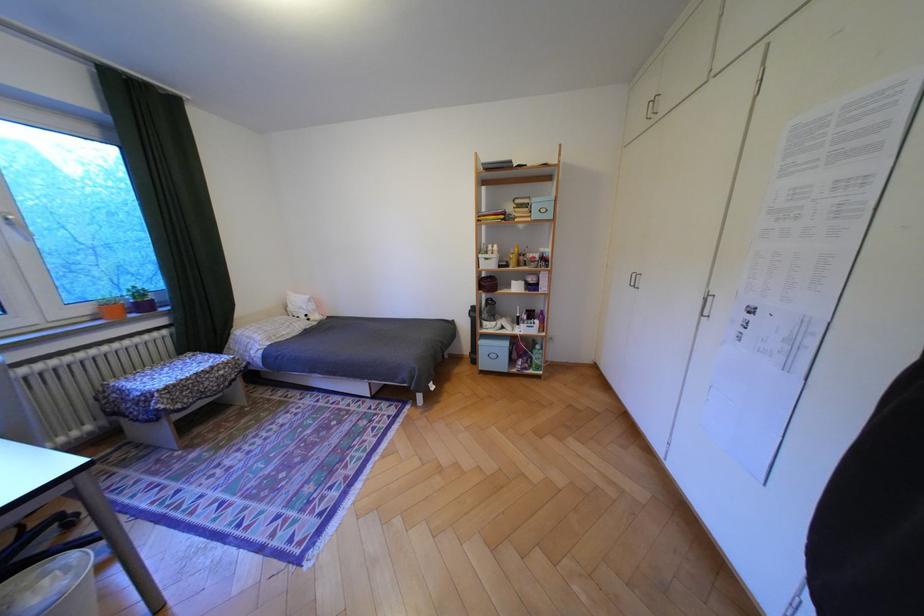
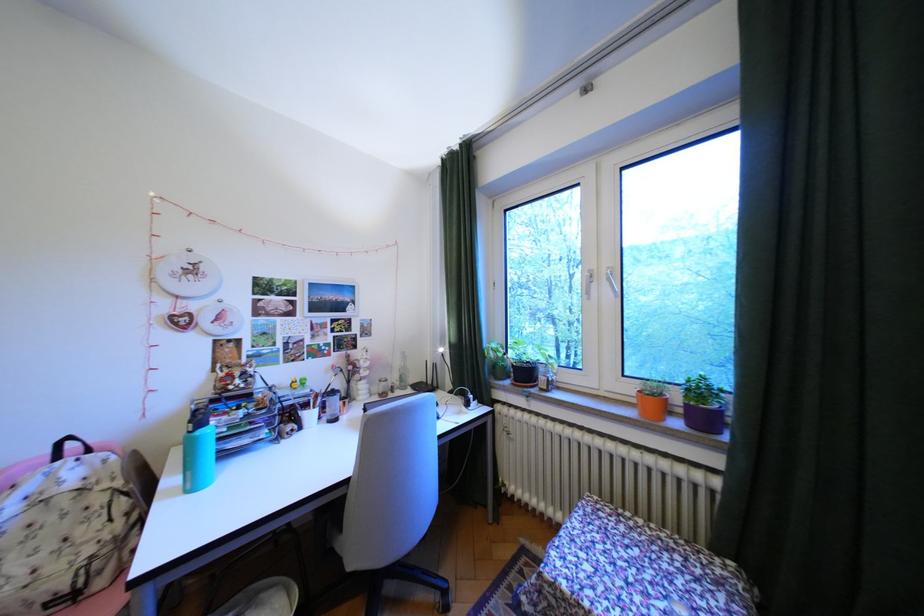
Where in the second image is the point corresponding to (152,293) from the first image?

(710, 391)